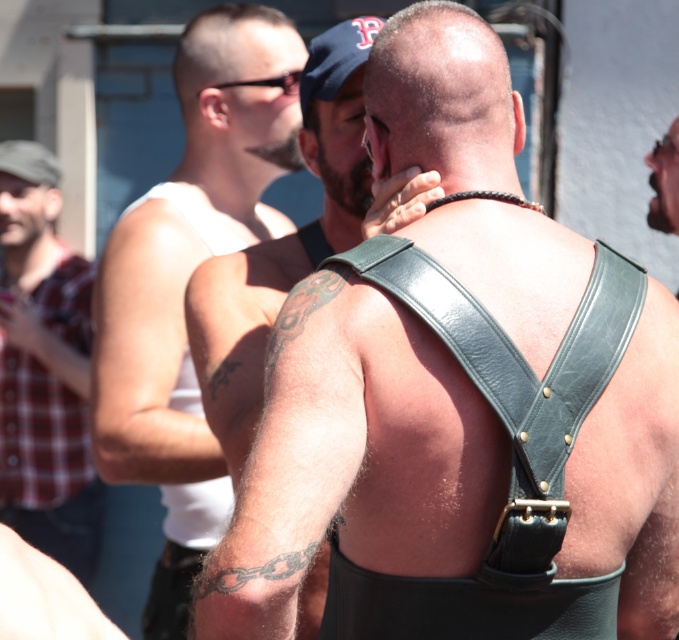
Question: Considering the real-world distances, which object is closest to the multicolored ink tattoo at shoulder?

Choices:
 (A) plaid fabric shirt at left
 (B) dark grey tattooed arm at center

Answer: (B)

Question: Is white leather tank top at left above black ink chain at lower left?

Choices:
 (A) no
 (B) yes

Answer: (B)

Question: Does black leather suspenders at center appear over leather harness at right?

Choices:
 (A) yes
 (B) no

Answer: (B)

Question: Is leather harness at center bigger than multicolored ink tattoo at shoulder?

Choices:
 (A) no
 (B) yes

Answer: (B)

Question: Among these objects, which one is nearest to the camera?

Choices:
 (A) dark grey tattooed arm at center
 (B) plaid fabric shirt at left

Answer: (A)

Question: Which point appears closest to the camera in this image?

Choices:
 (A) (230, 365)
 (B) (659, 144)
 (C) (181, 179)

Answer: (A)